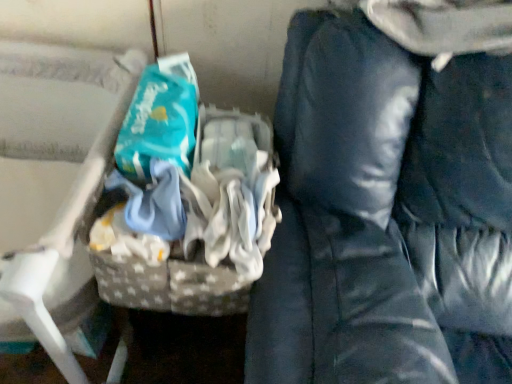
Question: From the image's perspective, relative to gray fabric basket at left, is dark blue fabric bean bag chair at right above or below?

Choices:
 (A) above
 (B) below

Answer: (B)

Question: Is point (467, 44) closer or farther from the camera than point (36, 183)?

Choices:
 (A) farther
 (B) closer

Answer: (B)

Question: Which object is positioned farthest from the gray fabric basket at left?

Choices:
 (A) teal fabric wipes at center
 (B) dark blue fabric bean bag chair at right

Answer: (B)

Question: Which object is the closest to the teal fabric wipes at center?

Choices:
 (A) dark blue fabric bean bag chair at right
 (B) gray fabric basket at left

Answer: (A)